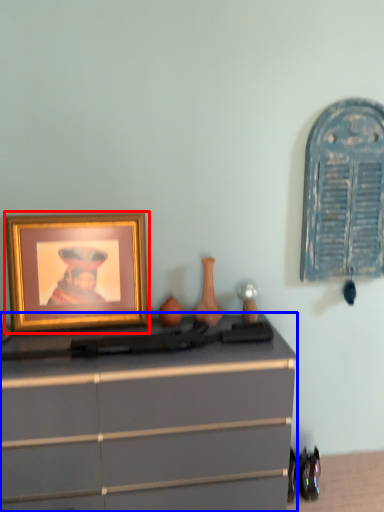
Question: Which of the following is the closest to the observer, picture frame (highlighted by a red box) or chest of drawers (highlighted by a blue box)?

Choices:
 (A) picture frame
 (B) chest of drawers

Answer: (B)